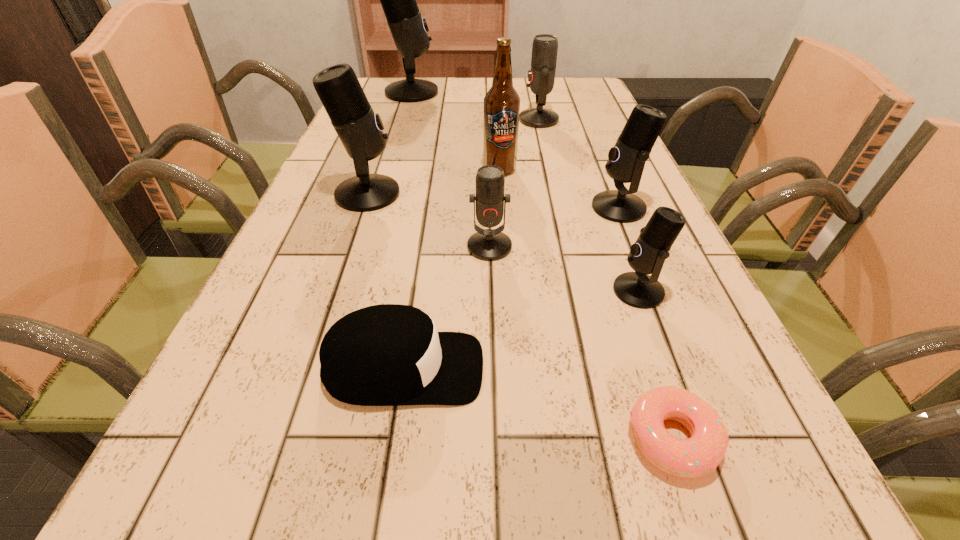
This screenshot has height=540, width=960. In order to click on free space located 0.340m on the stand of the third biggest black microphone in this screenshot , I will do `click(432, 207)`.

The image size is (960, 540). I want to click on vacant space located on the side of the bigger red microphone with the red ring, so click(431, 120).

Image resolution: width=960 pixels, height=540 pixels. I want to click on free space located on the side of the bigger red microphone with the red ring, so click(477, 120).

You are a GUI agent. You are given a task and a screenshot of the screen. Output one action in this format:
    pyautogui.click(x=<x>, y=<y>)
    Task: Click on the free space located 0.240m on the side of the bigger red microphone with the red ring
    
    Given the screenshot: What is the action you would take?
    pyautogui.click(x=435, y=120)

Where is `free space located on the stand of the seventh farthest object`? free space located on the stand of the seventh farthest object is located at coordinates (538, 291).

The height and width of the screenshot is (540, 960). I want to click on free spot located on the stand of the seventh farthest object, so click(438, 291).

You are a GUI agent. You are given a task and a screenshot of the screen. Output one action in this format:
    pyautogui.click(x=<x>, y=<y>)
    Task: Click on the vacant space situated 0.240m on the stand of the seventh farthest object
    The image size is (960, 540).
    Given the screenshot: What is the action you would take?
    pyautogui.click(x=473, y=291)

You are a GUI agent. You are given a task and a screenshot of the screen. Output one action in this format:
    pyautogui.click(x=<x>, y=<y>)
    Task: Click on the vacant space situated 0.120m on the side of the fifth farthest microphone with the red ring
    
    Given the screenshot: What is the action you would take?
    pyautogui.click(x=492, y=309)

Where is `free space located 0.200m on the front-facing side of the black cap`? free space located 0.200m on the front-facing side of the black cap is located at coordinates (621, 369).

The width and height of the screenshot is (960, 540). I want to click on vacant space located on the back of the shortest object, so click(x=623, y=294).